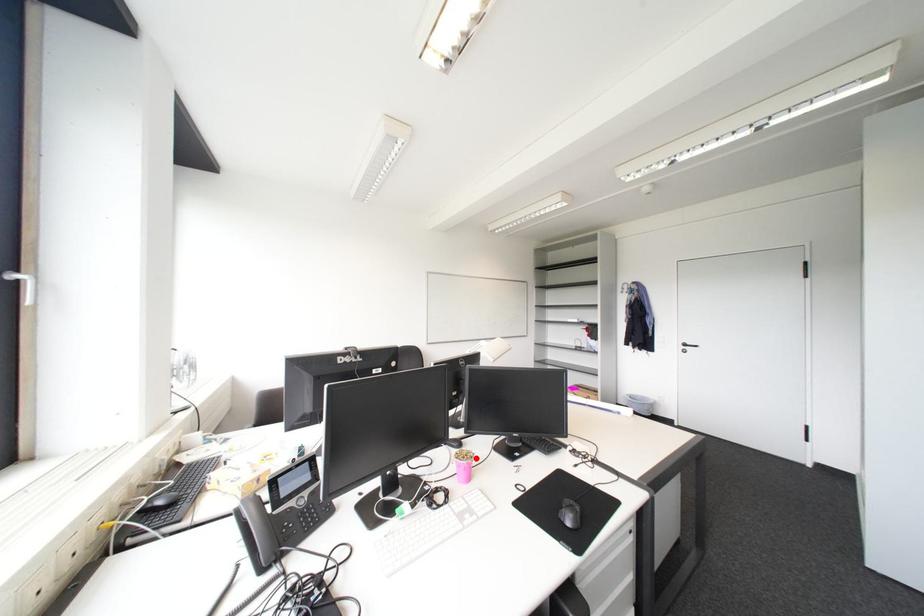
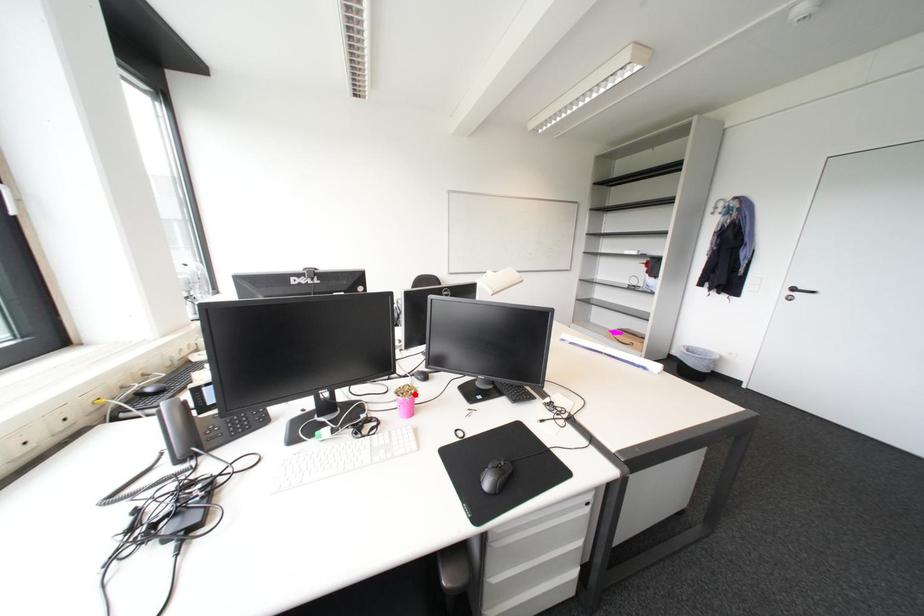
I am providing you with two images of the same scene from different viewpoints. A red point is marked on the first image and another point is marked on the second image. Do the highlighted points in image1 and image2 indicate the same real-world spot?

Yes